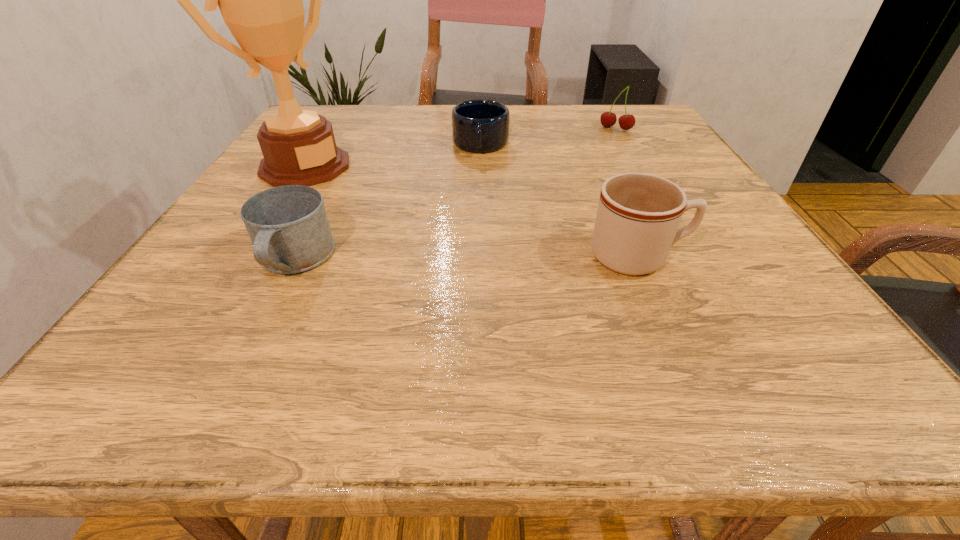
Identify the location of the closest object to the tallest object. The image size is (960, 540). (288, 226).

In order to click on the closest mug to the leftmost mug in this screenshot , I will do `click(480, 126)`.

Locate an element on the screen. the second closest mug to the second mug from right to left is located at coordinates (288, 226).